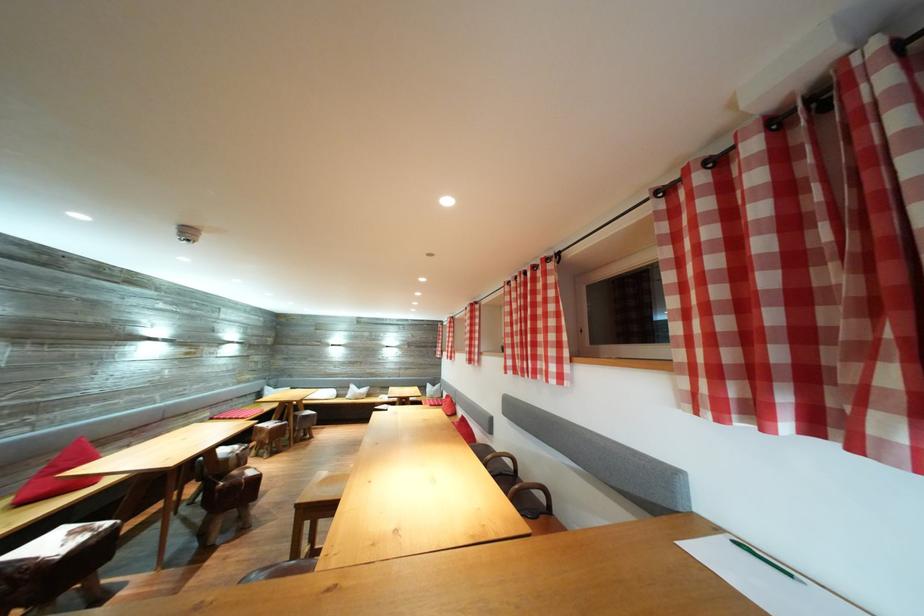
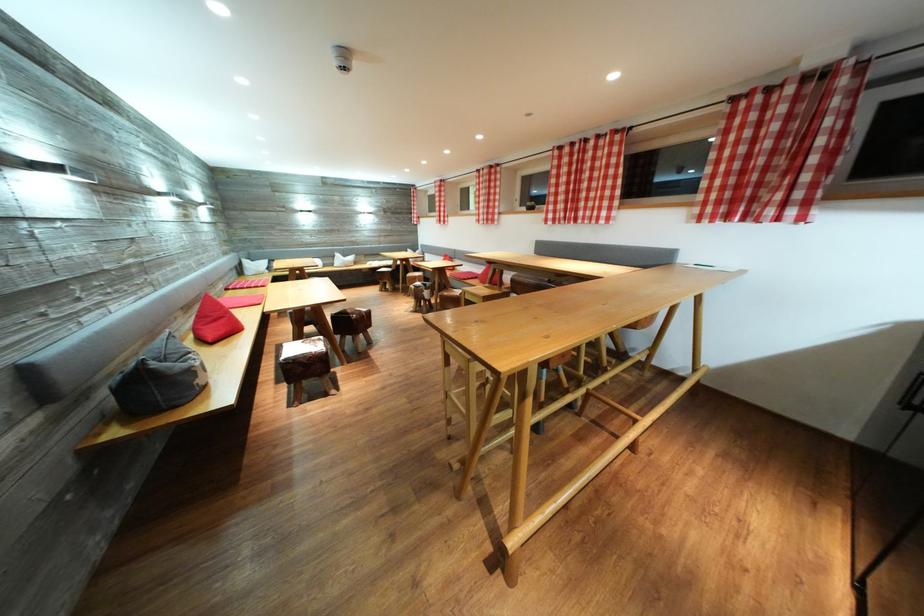
The point at (x=517, y=368) is marked in the first image. Where is the corresponding point in the second image?

(556, 222)